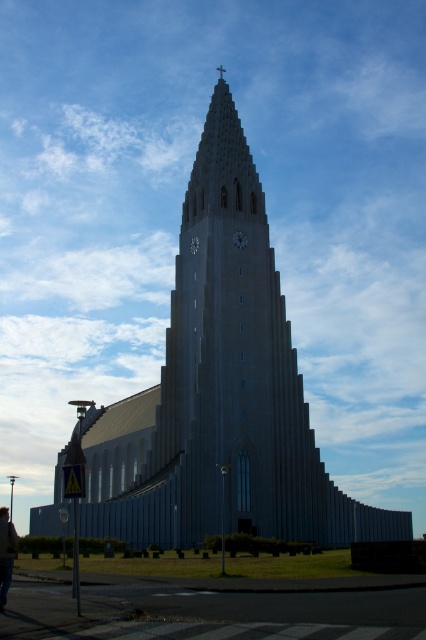
Question: Which object appears closest to the camera in this image?

Choices:
 (A) metallic gray clock at center
 (B) matte gray clock at center

Answer: (A)

Question: Does dark gray jacket at lower left appear under metallic gray clock at center?

Choices:
 (A) no
 (B) yes

Answer: (B)

Question: Can you confirm if smooth gray church at center is positioned to the left of dark gray jacket at lower left?

Choices:
 (A) yes
 (B) no

Answer: (B)

Question: Is dark gray jacket at lower left above matte gray clock at center?

Choices:
 (A) yes
 (B) no

Answer: (B)

Question: Estimate the real-world distances between objects in this image. Which object is farther from the metallic gray clock at center?

Choices:
 (A) smooth gray church at center
 (B) matte gray clock at center
 (C) dark gray jacket at lower left

Answer: (C)

Question: Considering the real-world distances, which object is closest to the dark gray jacket at lower left?

Choices:
 (A) matte gray clock at center
 (B) smooth gray church at center

Answer: (B)